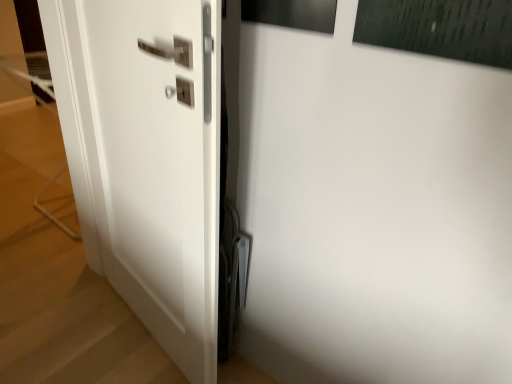
Locate an element on the screen. Image resolution: width=512 pixels, height=384 pixels. white glossy door at center is located at coordinates (146, 157).

Describe the element at coordinates (146, 157) in the screenshot. The height and width of the screenshot is (384, 512). I see `white glossy door at center` at that location.

At what (x,y) coordinates should I click in order to perform the action: click on white glossy door at center. Please return your answer as a coordinate pair (x, y). The height and width of the screenshot is (384, 512). Looking at the image, I should click on (146, 157).